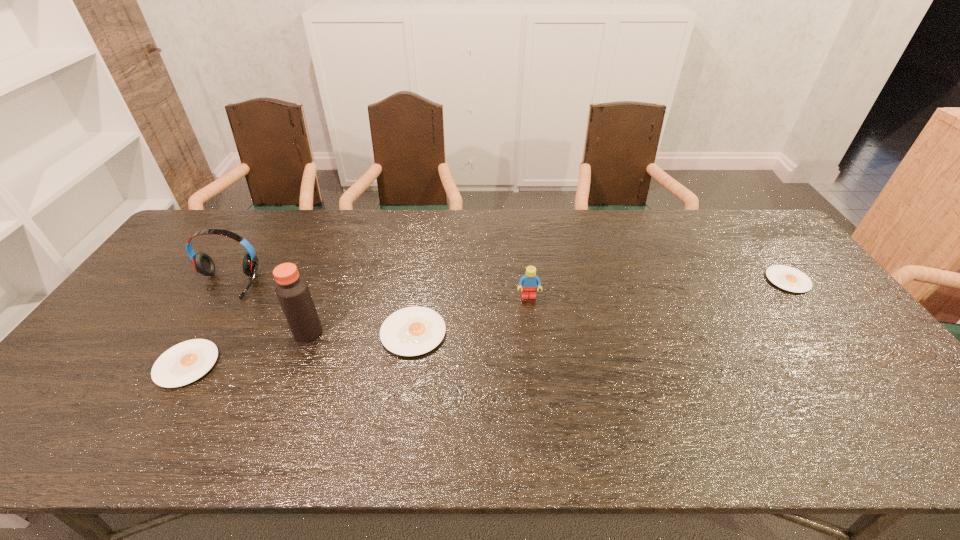
If the aim is uniform spacing by inserting an additional egg_yolk among them, please point to a vacant space for this new egg_yolk. Please provide its 2D coordinates. Your answer should be formatted as a tuple, i.e. [(x, y)], where the tuple contains the x and y coordinates of a point satisfying the conditions above.

[(612, 305)]